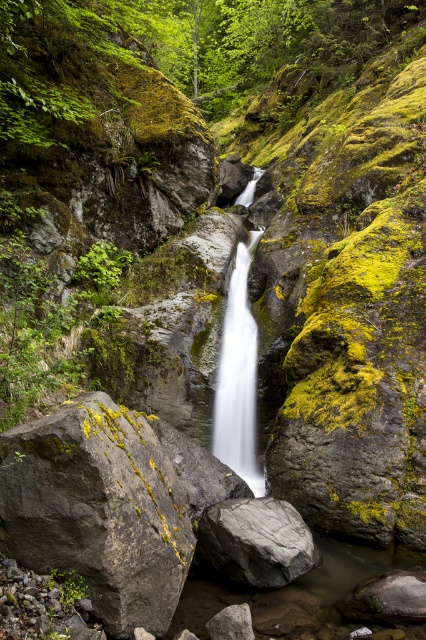
Which is in front, point (294, 556) or point (230, 300)?

Point (294, 556)

Does gray rock at center appear on the right side of white smooth waterfall at center?

Indeed, gray rock at center is positioned on the right side of white smooth waterfall at center.

Which is behind, point (258, 586) or point (233, 412)?

Positioned behind is point (233, 412).

The width and height of the screenshot is (426, 640). I want to click on gray rock at center, so click(256, 541).